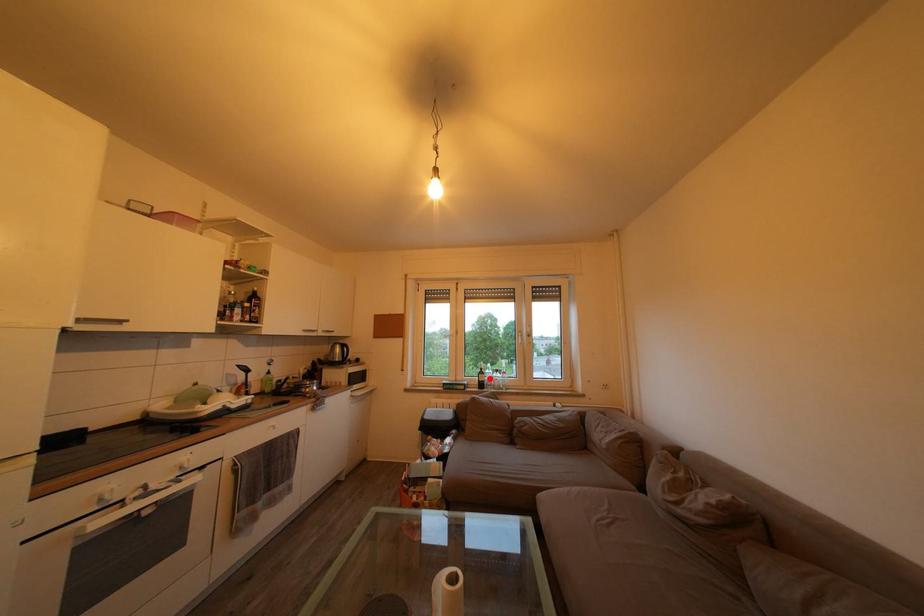
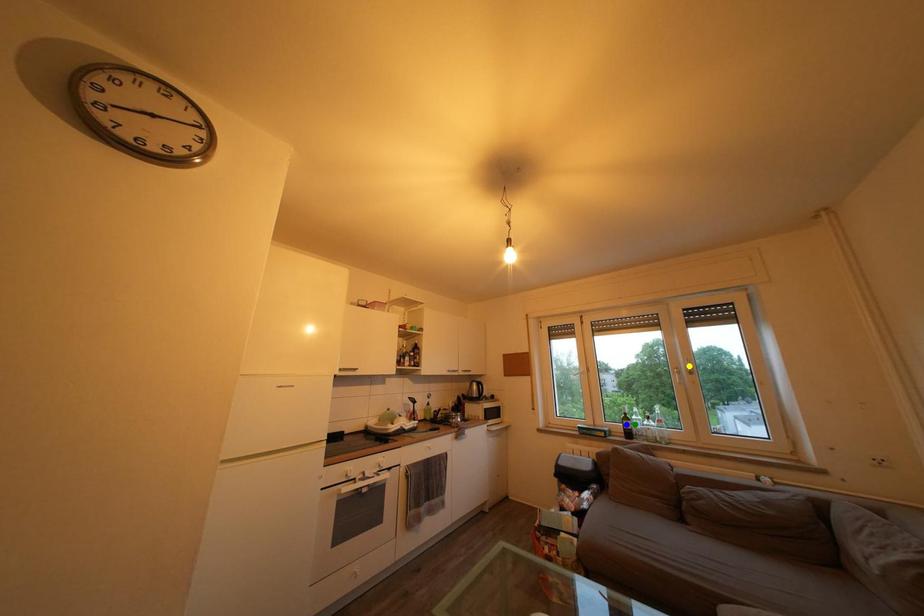
Question: I am providing you with two images of the same scene from different viewpoints. A red point is marked on the first image. You are given multiple points on the second image. In image 2, which mark is for the same physical point as the one in image 1?

Choices:
 (A) green point
 (B) yellow point
 (C) blue point

Answer: (A)